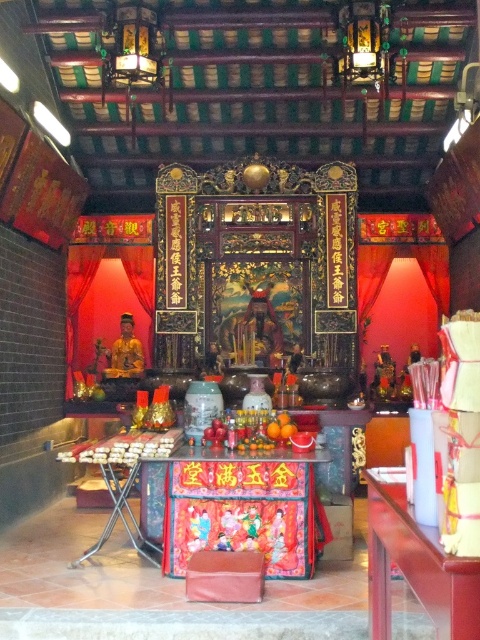
Question: Does smooth wooden table at center appear under velvet-like pink stool at center?

Choices:
 (A) yes
 (B) no

Answer: (B)

Question: Does colorful fabric altar at center have a lesser width compared to smooth wooden table at center?

Choices:
 (A) no
 (B) yes

Answer: (A)

Question: Estimate the real-world distances between objects in this image. Which object is closer to the velvet-like pink stool at center?

Choices:
 (A) colorful fabric altar at center
 (B) smooth wooden table at center

Answer: (A)

Question: Which object is positioned farthest from the velvet-like pink stool at center?

Choices:
 (A) smooth wooden table at center
 (B) colorful fabric altar at center

Answer: (A)

Question: Is colorful fabric altar at center wider than velvet-like pink stool at center?

Choices:
 (A) yes
 (B) no

Answer: (A)

Question: Which of these objects is positioned farthest from the smooth wooden table at center?

Choices:
 (A) velvet-like pink stool at center
 (B) colorful fabric altar at center

Answer: (B)